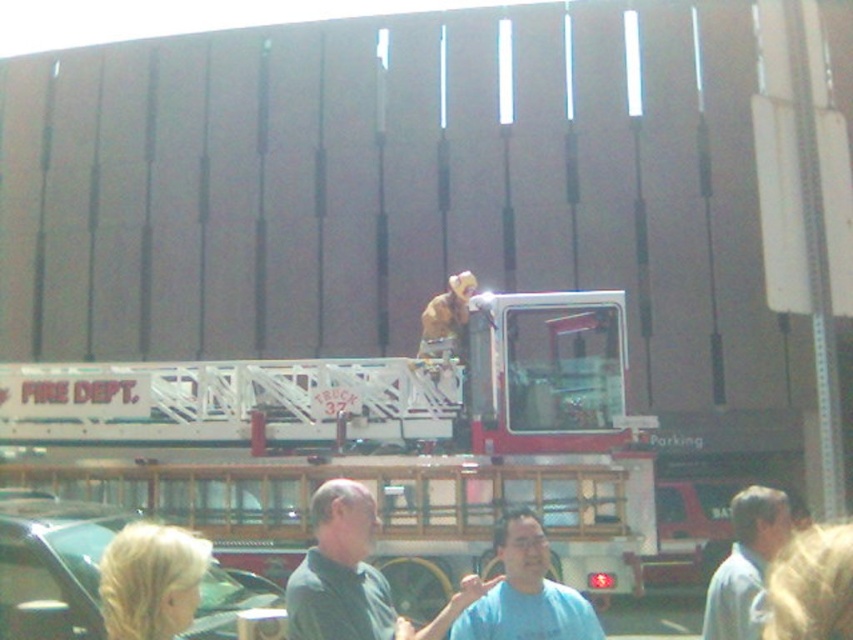
Question: Observing the image, what is the correct spatial positioning of gray-green shirt at center in reference to blonde hair at lower left?

Choices:
 (A) below
 (B) above

Answer: (A)

Question: Observing the image, what is the correct spatial positioning of blonde hair at lower left in reference to blue t-shirt at center?

Choices:
 (A) right
 (B) left

Answer: (B)

Question: Which object is farther from the camera taking this photo?

Choices:
 (A) brown leather jacket at upper center
 (B) white metallic ladder at center
 (C) gray-green shirt at center
 (D) blonde hair at lower left

Answer: (A)

Question: Which is farther from the brown leather jacket at upper center?

Choices:
 (A) gray-green shirt at center
 (B) blue t-shirt at center
 (C) blonde hair at lower left
 (D) light blue shirt at lower right

Answer: (C)

Question: In this image, where is gray-green shirt at center located relative to blue t-shirt at center?

Choices:
 (A) below
 (B) above

Answer: (B)

Question: Which of these objects is positioned closest to the gray-green shirt at center?

Choices:
 (A) light blue shirt at lower right
 (B) blue t-shirt at center
 (C) blonde hair at lower left
 (D) white metallic ladder at center

Answer: (B)